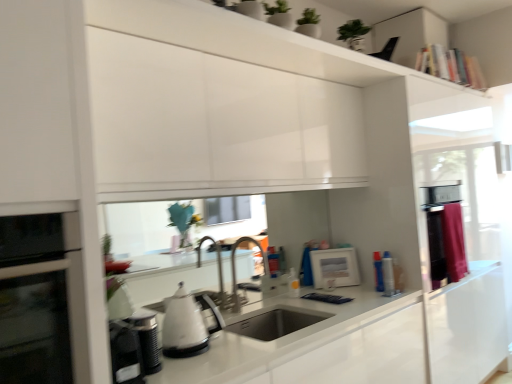
Question: Is white glossy picture frame at center, which ranks as the 1th appliance in back-to-front order, in front of or behind black glass oven at left in the image?

Choices:
 (A) behind
 (B) front

Answer: (A)

Question: From a real-world perspective, is white glossy picture frame at center, acting as the 2th appliance starting from the right, physically located above or below black glass oven at left?

Choices:
 (A) above
 (B) below

Answer: (B)

Question: Which is farther from the silver metallic canister at right, the 2th appliance viewed from the back?

Choices:
 (A) white glossy picture frame at center, placed as the 3th appliance when sorted from left to right
 (B) maroon fabric curtain at right
 (C) white glossy kettle at lower center, arranged as the second appliance when viewed from the front
 (D) black glass oven at left
 (E) satin nickel faucet at center

Answer: (D)

Question: Which object is positioned farthest from the white glossy picture frame at center, acting as the 2th appliance starting from the right?

Choices:
 (A) silver metallic canister at right, which is counted as the fourth appliance, starting from the left
 (B) white glossy kettle at center
 (C) black glass oven at left
 (D) satin nickel faucet at center
 (E) maroon fabric curtain at right

Answer: (C)